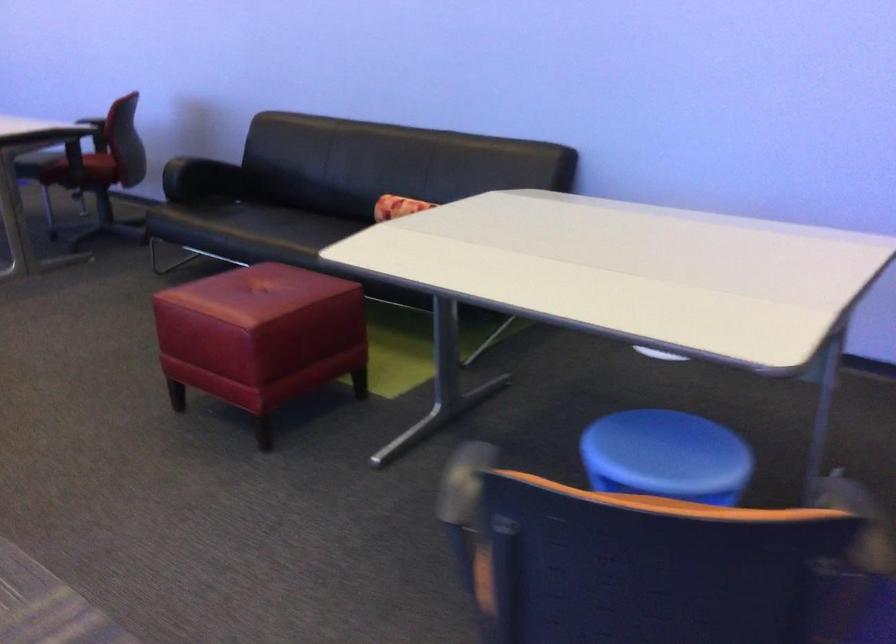
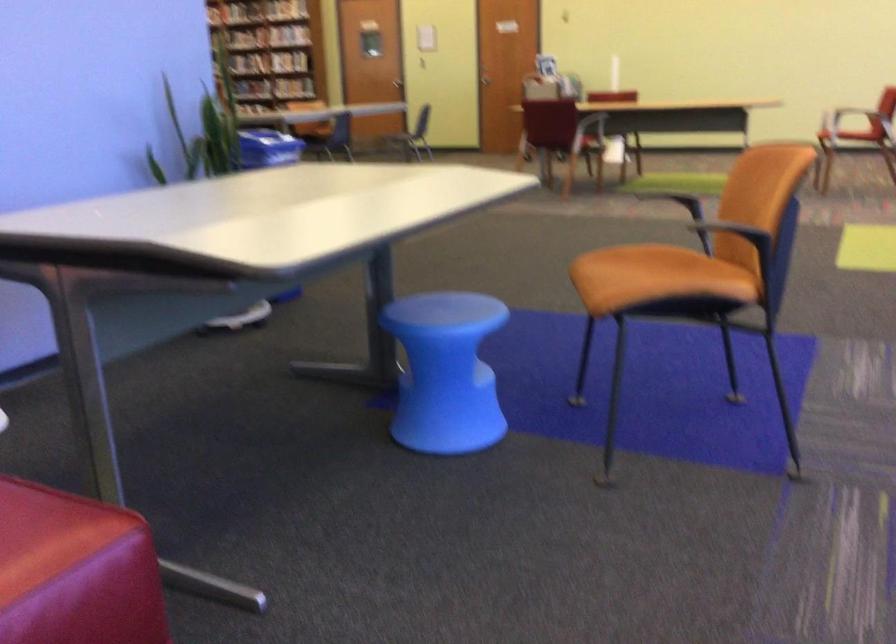
Find the pixel in the second image that matches pixel 247 315 in the first image.

(47, 534)